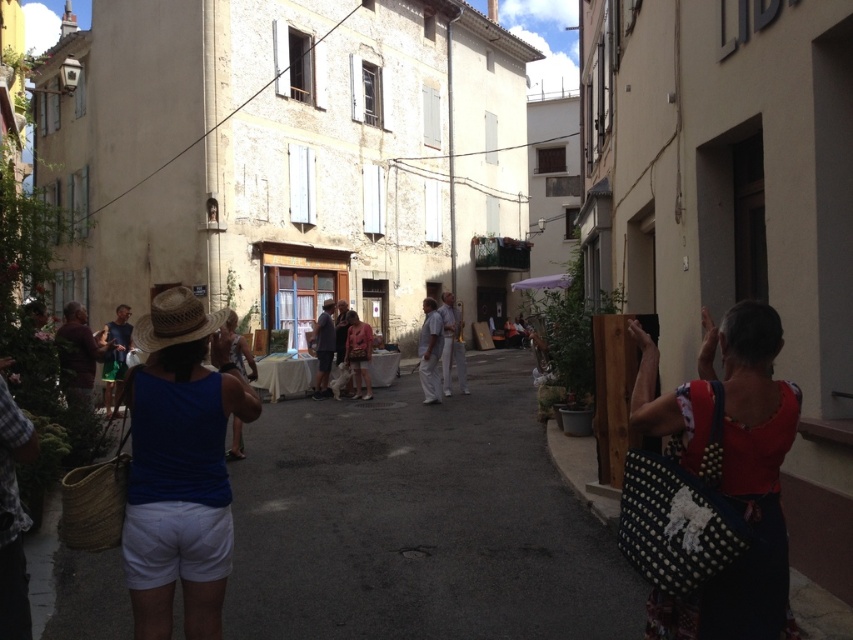
You are standing on the street and want to hand a leaflet to the person wearing the white cotton pants at center. Which direction should you approach from relative to the blue fabric hat at left?

The blue fabric hat at left is positioned under white cotton pants at center, so you should approach from above the blue fabric hat at left to reach the white cotton pants at center.

You are standing at the point labeled as point (750, 426) in the image. You want to walk to the entrance of the building located at the end of the street. The entrance is 5 meters away from your current position. Can you reach the entrance without moving more than 5 meters?

The distance between point (750, 426) and the viewer is 2.60 meters. Since the entrance is 5 meters away from your current position, you can reach it without exceeding the 5 meters limit.